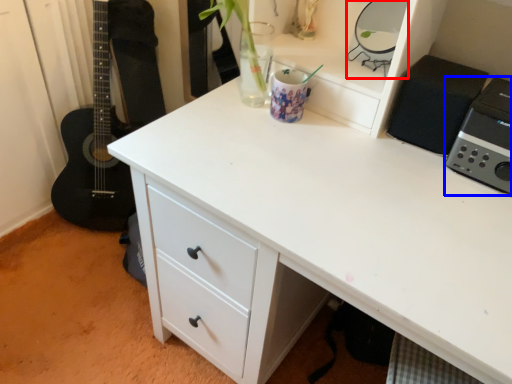
Question: Among these objects, which one is nearest to the camera, appliance (highlighted by a red box) or appliance (highlighted by a blue box)?

Choices:
 (A) appliance
 (B) appliance

Answer: (B)